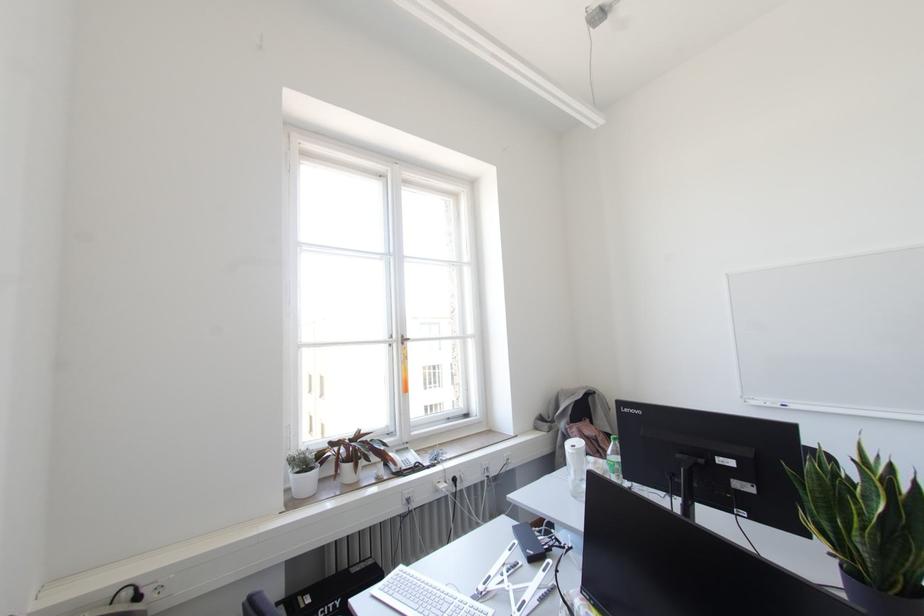
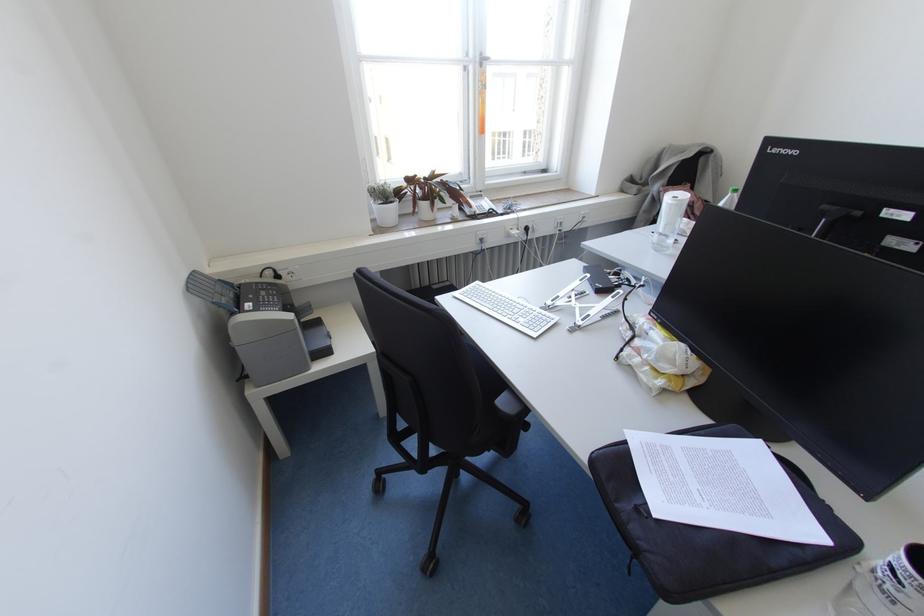
The point at [402,342] is marked in the first image. Where is the corresponding point in the second image?

(480, 65)